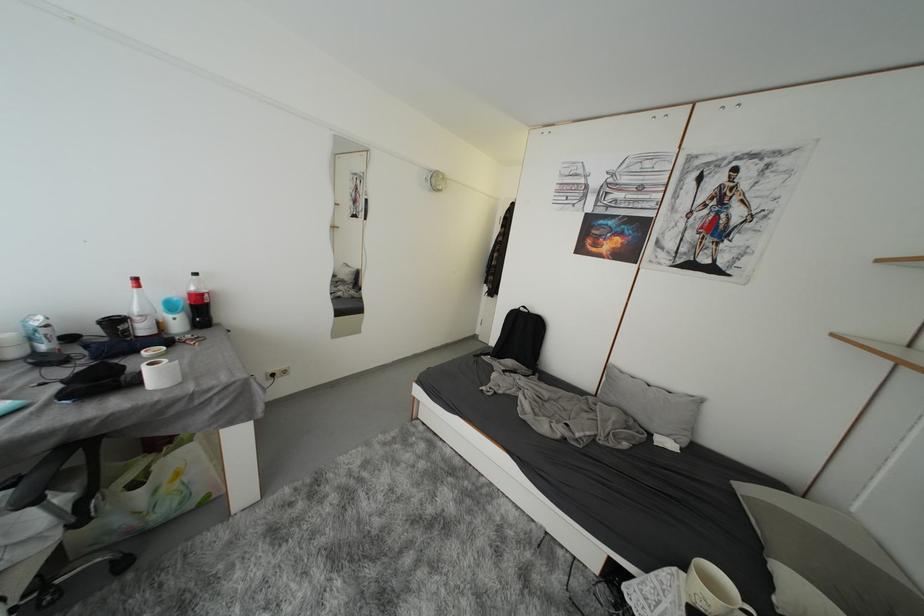
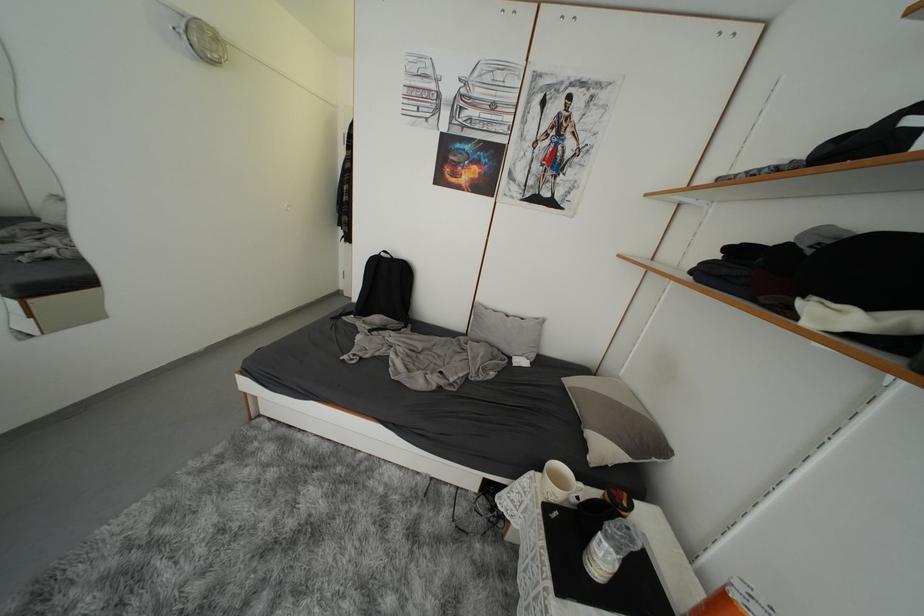
Where in the second image is the point corresponding to pixel 718 589 from the first image?

(565, 484)